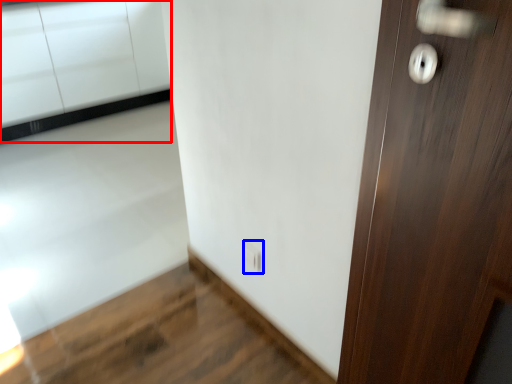
Question: Among these objects, which one is nearest to the camera, cabinetry (highlighted by a red box) or electric outlet (highlighted by a blue box)?

Choices:
 (A) cabinetry
 (B) electric outlet

Answer: (B)